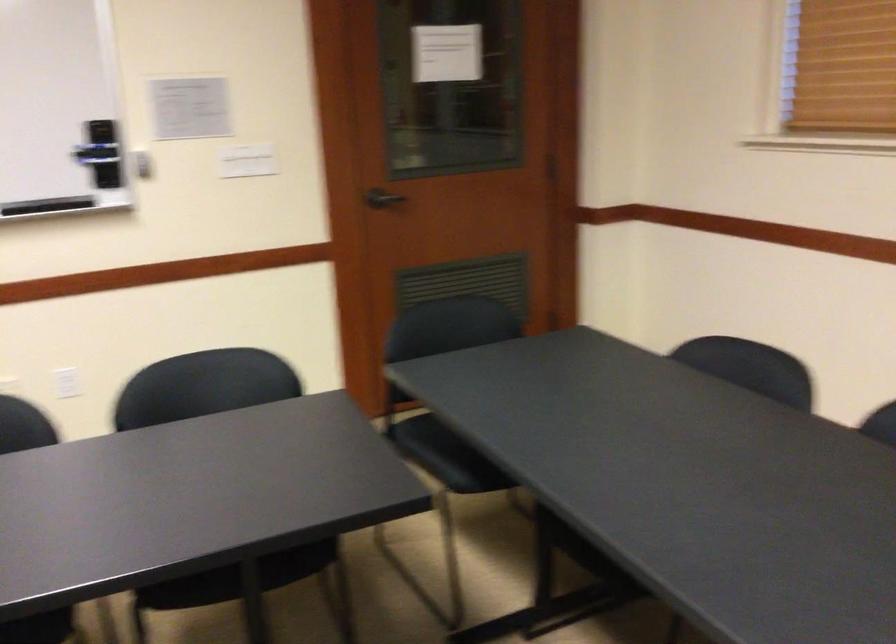
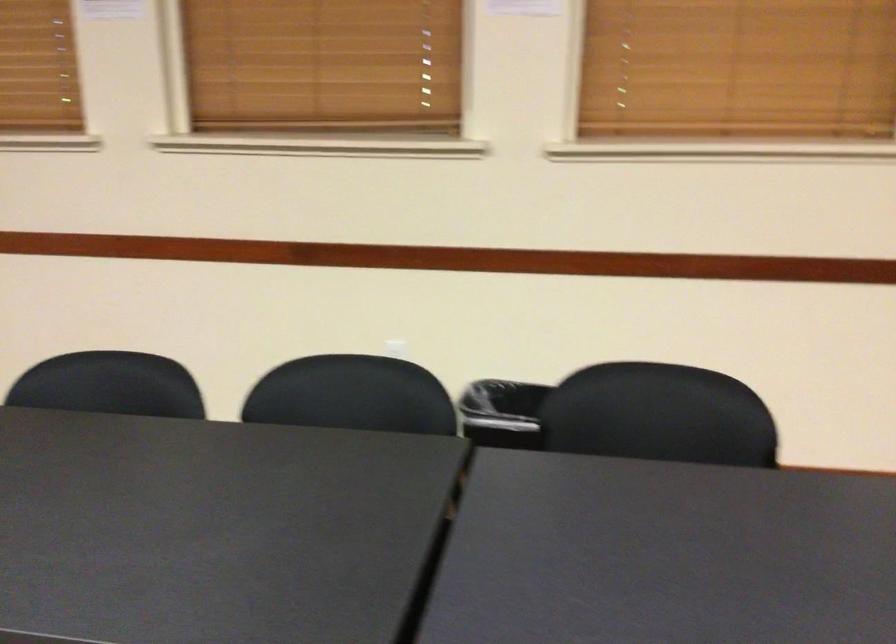
Question: The first image is from the beginning of the video and the second image is from the end. How did the camera likely rotate when shooting the video?

Choices:
 (A) Left
 (B) Right
 (C) Up
 (D) Down

Answer: (B)